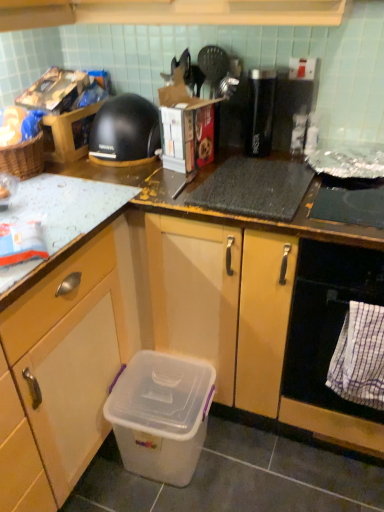
From the picture: What is the approximate width of black matte coffee maker at upper left?

11.19 inches.

Find the location of a particular element. black plastic toaster at upper right, which ranks as the second appliance in left-to-right order is located at coordinates (289, 108).

In order to face transparent plastic storage box at lower left, should I rotate leftwards or rightwards?

To face it directly, rotate left by 3.497 degrees.

The height and width of the screenshot is (512, 384). I want to click on black glossy thermos at upper center, which appears as the 2th appliance when viewed from the right, so click(x=260, y=111).

Measure the distance between point (314, 401) and camera.

1.37 meters.

Image resolution: width=384 pixels, height=512 pixels. What do you see at coordinates (75, 348) in the screenshot?
I see `matte plastic container at lower center` at bounding box center [75, 348].

This screenshot has height=512, width=384. Find the location of `black matte coffee maker at upper left`. black matte coffee maker at upper left is located at coordinates (125, 131).

Where is `cloth on the right side of matte plastic container at lower center`? The height and width of the screenshot is (512, 384). cloth on the right side of matte plastic container at lower center is located at coordinates (360, 357).

How distant is white checkered towel at lower right from matte plastic container at lower center?

white checkered towel at lower right is 28.49 inches away from matte plastic container at lower center.

How different are the orientations of white checkered towel at lower right and matte plastic container at lower center in degrees?

90 degrees.

In terms of size, does white checkered towel at lower right appear bigger or smaller than matte plastic container at lower center?

Clearly, white checkered towel at lower right is smaller in size than matte plastic container at lower center.

Measure the distance from black plastic toaster at upper right, marked as the first appliance in a right-to-left arrangement, to black glossy thermos at upper center, positioned as the 1th appliance in left-to-right order.

The distance of black plastic toaster at upper right, marked as the first appliance in a right-to-left arrangement, from black glossy thermos at upper center, positioned as the 1th appliance in left-to-right order, is 2.60 inches.

Is black plastic toaster at upper right, which ranks as the second appliance in left-to-right order, shorter than black glossy thermos at upper center, which appears as the 2th appliance when viewed from the right?

Indeed, black plastic toaster at upper right, which ranks as the second appliance in left-to-right order, has a lesser height compared to black glossy thermos at upper center, which appears as the 2th appliance when viewed from the right.

Which is in front, point (293, 104) or point (273, 113)?

The point (293, 104) is closer.

Locate an element on the screen. The width and height of the screenshot is (384, 512). appliance directly beneath the black glossy thermos at upper center, which appears as the 2th appliance when viewed from the right (from a real-world perspective) is located at coordinates (289, 108).

Which is behind, point (373, 350) or point (309, 106)?

The point (309, 106) is behind.

In the image, is white checkered towel at lower right positioned in front of or behind black plastic toaster at upper right, which ranks as the second appliance in left-to-right order?

white checkered towel at lower right is in front of black plastic toaster at upper right, which ranks as the second appliance in left-to-right order.

From the image's perspective, is white checkered towel at lower right located above black plastic toaster at upper right, which ranks as the second appliance in left-to-right order?

Actually, white checkered towel at lower right appears below black plastic toaster at upper right, which ranks as the second appliance in left-to-right order, in the image.

From the picture: Does white checkered towel at lower right have a greater height compared to black plastic toaster at upper right, marked as the first appliance in a right-to-left arrangement?

Yes.

Between black matte coffee maker at upper left and black plastic toaster at upper right, which ranks as the second appliance in left-to-right order, which one has larger size?

black matte coffee maker at upper left is bigger.

Is black matte coffee maker at upper left inside the boundaries of black plastic toaster at upper right, marked as the first appliance in a right-to-left arrangement, or outside?

black matte coffee maker at upper left is spatially situated outside black plastic toaster at upper right, marked as the first appliance in a right-to-left arrangement.

Can you confirm if black matte coffee maker at upper left is shorter than black plastic toaster at upper right, which ranks as the second appliance in left-to-right order?

Yes.

From a real-world perspective, is black matte coffee maker at upper left on black plastic toaster at upper right, which ranks as the second appliance in left-to-right order?

Incorrect, from a real-world perspective, black matte coffee maker at upper left is lower than black plastic toaster at upper right, which ranks as the second appliance in left-to-right order.

From a real-world perspective, which object rests below the other?

white checkered towel at lower right is physically lower.

Considering the points (103, 104) and (354, 313), which point is in front, point (103, 104) or point (354, 313)?

The point (354, 313) is closer.

Which is more to the right, black matte coffee maker at upper left or white checkered towel at lower right?

white checkered towel at lower right.

Considering the positions of point (75, 331) and point (374, 445), is point (75, 331) closer or farther from the camera than point (374, 445)?

Point (75, 331).

Can you tell me how much matte plastic container at lower center and black matte oven at lower right differ in facing direction?

The angular difference between matte plastic container at lower center and black matte oven at lower right is 90 degrees.

Is matte plastic container at lower center further to camera compared to black matte oven at lower right?

No, matte plastic container at lower center is closer to the camera.

Is matte plastic container at lower center aimed at black plastic toaster at upper right, marked as the first appliance in a right-to-left arrangement?

Yes, matte plastic container at lower center is aimed at black plastic toaster at upper right, marked as the first appliance in a right-to-left arrangement.

How many degrees apart are the facing directions of matte plastic container at lower center and black plastic toaster at upper right, marked as the first appliance in a right-to-left arrangement?

The facing directions of matte plastic container at lower center and black plastic toaster at upper right, marked as the first appliance in a right-to-left arrangement, are 91.3 degrees apart.

Does point (84, 452) appear closer or farther from the camera than point (286, 142)?

Point (84, 452).

In terms of width, does matte plastic container at lower center look wider or thinner when compared to black plastic toaster at upper right, which ranks as the second appliance in left-to-right order?

matte plastic container at lower center is wider than black plastic toaster at upper right, which ranks as the second appliance in left-to-right order.

Find the location of `cloth on the right side of matte plastic container at lower center`. cloth on the right side of matte plastic container at lower center is located at coordinates (360, 357).

You are a GUI agent. You are given a task and a screenshot of the screen. Output one action in this format:
    pyautogui.click(x=<x>, y=<y>)
    Task: Click on the appliance behind the black glossy thermos at upper center, which appears as the 2th appliance when viewed from the right
    This screenshot has width=384, height=512.
    Given the screenshot: What is the action you would take?
    pyautogui.click(x=289, y=108)

From the image, which object appears to be farther from white checkered towel at lower right, black matte oven at lower right or matte plastic container at lower center?

matte plastic container at lower center is positioned further to the anchor white checkered towel at lower right.

Considering their positions, is black matte coffee maker at upper left positioned further to black plastic toaster at upper right, which ranks as the second appliance in left-to-right order, than transparent plastic storage box at lower left?

transparent plastic storage box at lower left lies further to black plastic toaster at upper right, which ranks as the second appliance in left-to-right order, than the other object.

Looking at this image, considering their positions, is black matte coffee maker at upper left positioned closer to white checkered towel at lower right than matte plastic container at lower center?

matte plastic container at lower center lies closer to white checkered towel at lower right than the other object.

Based on their spatial positions, is black glossy thermos at upper center, which appears as the 2th appliance when viewed from the right, or matte plastic container at lower center further from black matte oven at lower right?

The object further to black matte oven at lower right is black glossy thermos at upper center, which appears as the 2th appliance when viewed from the right.

Based on the photo, when comparing their distances from black plastic toaster at upper right, marked as the first appliance in a right-to-left arrangement, does black matte oven at lower right or transparent plastic storage box at lower left seem further?

Based on the image, transparent plastic storage box at lower left appears to be further to black plastic toaster at upper right, marked as the first appliance in a right-to-left arrangement.

Estimate the real-world distances between objects in this image. Which object is further from white checkered towel at lower right, black glossy thermos at upper center, positioned as the 1th appliance in left-to-right order, or black matte coffee maker at upper left?

black matte coffee maker at upper left is further to white checkered towel at lower right.

Based on their spatial positions, is white checkered towel at lower right or black matte coffee maker at upper left closer to black matte oven at lower right?

The object closer to black matte oven at lower right is white checkered towel at lower right.

Which object lies further to the anchor point white checkered towel at lower right, black glossy thermos at upper center, positioned as the 1th appliance in left-to-right order, or black matte oven at lower right?

black glossy thermos at upper center, positioned as the 1th appliance in left-to-right order.

You are a GUI agent. You are given a task and a screenshot of the screen. Output one action in this format:
    pyautogui.click(x=<x>, y=<y>)
    Task: Click on the kitchen appliance between matte plastic container at lower center and black matte oven at lower right from left to right
    This screenshot has width=384, height=512.
    Given the screenshot: What is the action you would take?
    pyautogui.click(x=125, y=131)

At what (x,y) coordinates should I click in order to perform the action: click on kitchen appliance between matte plastic container at lower center and white checkered towel at lower right. Please return your answer as a coordinate pair (x, y). Looking at the image, I should click on (125, 131).

Where is `appliance between black glossy thermos at upper center, positioned as the 1th appliance in left-to-right order, and black matte oven at lower right vertically`? appliance between black glossy thermos at upper center, positioned as the 1th appliance in left-to-right order, and black matte oven at lower right vertically is located at coordinates (289, 108).

This screenshot has width=384, height=512. I want to click on cloth between black matte coffee maker at upper left and black matte oven at lower right, so click(360, 357).